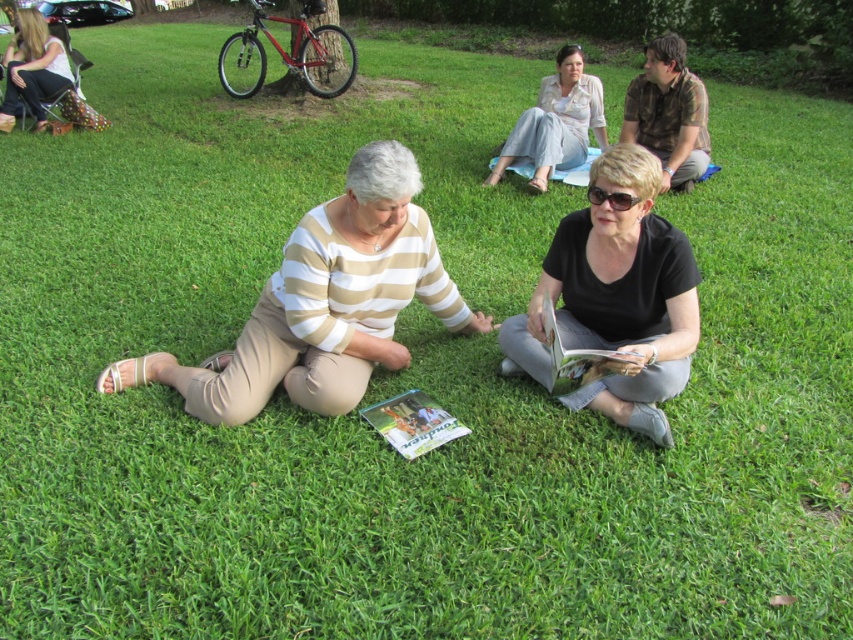
From the picture: Is beige striped shirt at center thinner than matte green magazine at center?

No, beige striped shirt at center is not thinner than matte green magazine at center.

What do you see at coordinates (323, 304) in the screenshot? I see `beige striped shirt at center` at bounding box center [323, 304].

At what (x,y) coordinates should I click in order to perform the action: click on beige striped shirt at center. Please return your answer as a coordinate pair (x, y). Looking at the image, I should click on (323, 304).

Who is lower down, matte green magazine at center or matte paper book at center?

Positioned lower is matte green magazine at center.

Is point (444, 435) positioned in front of point (616, 362)?

No.

Locate an element on the screen. The width and height of the screenshot is (853, 640). matte green magazine at center is located at coordinates (x=412, y=422).

Does beige striped shirt at center have a greater width compared to brown camo shirt at upper right?

Indeed, beige striped shirt at center has a greater width compared to brown camo shirt at upper right.

Is point (234, 346) positioned after point (654, 113)?

No, (234, 346) is closer to viewer.

The height and width of the screenshot is (640, 853). I want to click on beige striped shirt at center, so click(x=323, y=304).